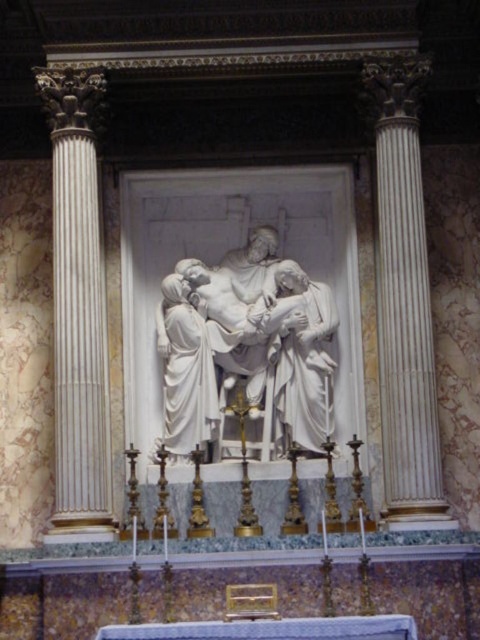
Question: Which of the following is the closest to the observer?

Choices:
 (A) (52, 204)
 (B) (181, 404)

Answer: (B)

Question: Is white marble sculpture at center thinner than white marble statue at center?

Choices:
 (A) yes
 (B) no

Answer: (B)

Question: Among these points, which one is farthest from the camera?

Choices:
 (A) (389, 419)
 (B) (176, 328)
 (C) (331, 301)
 (D) (84, 435)

Answer: (C)

Question: Is white marble sculpture at center thinner than white marble column at center?

Choices:
 (A) yes
 (B) no

Answer: (B)

Question: Is white marble sculpture at center below white marble statue at left?

Choices:
 (A) yes
 (B) no

Answer: (B)

Question: Which object appears farthest from the camera in this image?

Choices:
 (A) white marble column at left
 (B) white marble sculpture at center
 (C) white marble column at center
 (D) white marble statue at center

Answer: (D)